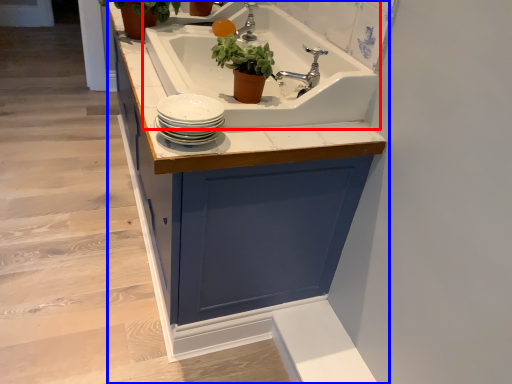
Question: Which object appears closest to the camera in this image, sink (highlighted by a red box) or cabinetry (highlighted by a blue box)?

Choices:
 (A) sink
 (B) cabinetry

Answer: (B)